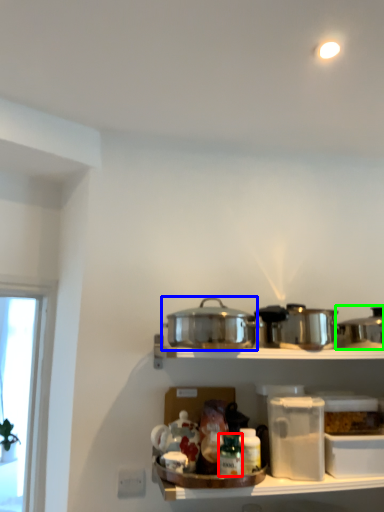
Question: Which object is the farthest from bottle (highlighted by a red box)? Choose among these: crock pot (highlighted by a blue box) or crock pot (highlighted by a green box).

Choices:
 (A) crock pot
 (B) crock pot

Answer: (B)